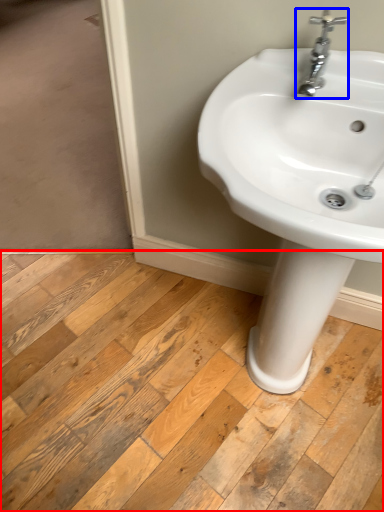
Question: Which of the following is the closest to the observer, plank (highlighted by a red box) or tap (highlighted by a blue box)?

Choices:
 (A) plank
 (B) tap

Answer: (B)